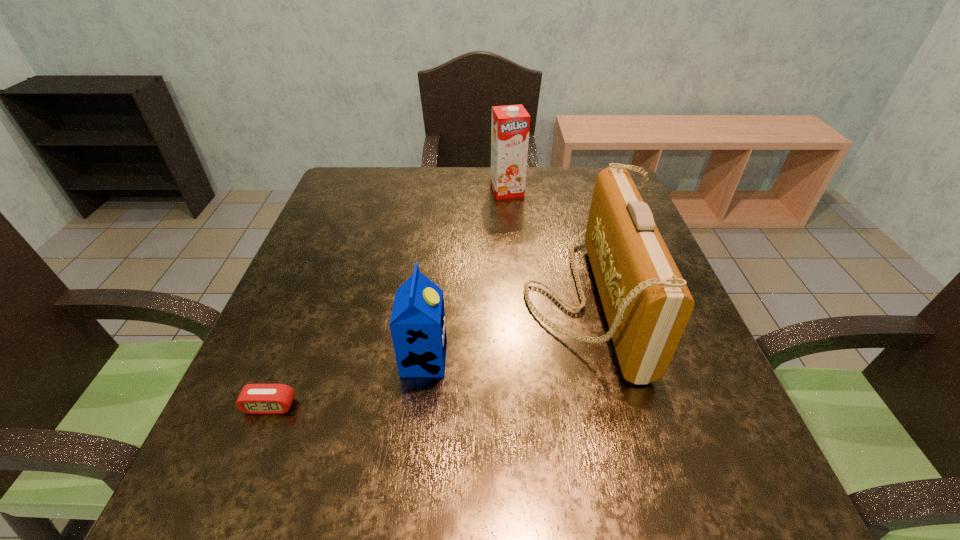
Where is `vacant area situated 0.090m on the decorative side of the handbag`? This screenshot has width=960, height=540. vacant area situated 0.090m on the decorative side of the handbag is located at coordinates (482, 298).

Locate an element on the screen. The width and height of the screenshot is (960, 540). vacant space located with the cap open on the second shortest object is located at coordinates (563, 359).

This screenshot has height=540, width=960. Identify the location of free space located 0.150m on the front-facing side of the shortest object. (229, 509).

Image resolution: width=960 pixels, height=540 pixels. Identify the location of object at the far edge. (510, 126).

Image resolution: width=960 pixels, height=540 pixels. Find the location of `object that is at the left edge`. object that is at the left edge is located at coordinates [254, 398].

Find the location of a particular element. Image resolution: width=960 pixels, height=540 pixels. object present at the right edge is located at coordinates (647, 304).

In the image, there is a desktop. Find the location of `free space at the far edge`. free space at the far edge is located at coordinates (484, 195).

Where is `vacant space at the near edge`? This screenshot has width=960, height=540. vacant space at the near edge is located at coordinates (423, 494).

Where is `free point at the left edge`? free point at the left edge is located at coordinates (326, 335).

The image size is (960, 540). What are the coordinates of `vacant space at the right edge of the desktop` in the screenshot? It's located at (645, 423).